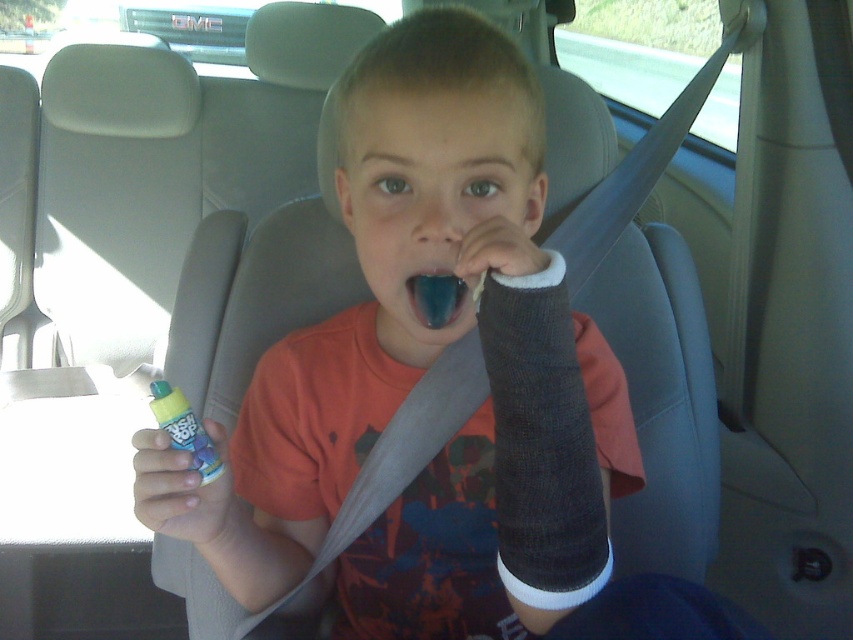
You are a passenger in the car and want to reach both the point at coordinate (190, 449) and the point at coordinate (428, 305). Which coordinate is closer to you?

Point (190, 449) is in front of point (428, 305), so the point at coordinate (190, 449) is closer to you.

The boy is holding a translucent plastic bottle at lower left and has teeth enamel at center. Which object is closer to the bottom of the image?

The translucent plastic bottle at lower left is closer to the bottom of the image because it is positioned under the teeth enamel at center.

The boy in the car has a translucent plastic bottle and some visible teeth. Which object is taller, the translucent plastic bottle at lower left or the teeth enamel at center?

The translucent plastic bottle at lower left is taller than the teeth enamel at center according to the description.